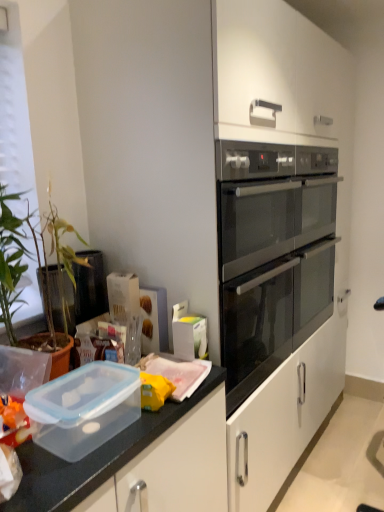
Question: Is transparent plastic container at lower left bigger or smaller than satin black oven at center right?

Choices:
 (A) small
 (B) big

Answer: (A)

Question: Is transparent plastic container at lower left inside or outside of satin black oven at center right?

Choices:
 (A) outside
 (B) inside

Answer: (A)

Question: In the image, is transparent plastic container at lower left on the left side or the right side of satin black oven at center right?

Choices:
 (A) left
 (B) right

Answer: (A)

Question: In terms of size, does satin black oven at center right appear bigger or smaller than transparent plastic container at lower left?

Choices:
 (A) big
 (B) small

Answer: (A)

Question: Visually, is satin black oven at center right positioned to the left or to the right of transparent plastic container at lower left?

Choices:
 (A) right
 (B) left

Answer: (A)

Question: Considering their positions, is satin black oven at center right located in front of or behind transparent plastic container at lower left?

Choices:
 (A) behind
 (B) front

Answer: (A)

Question: In terms of height, does satin black oven at center right look taller or shorter compared to transparent plastic container at lower left?

Choices:
 (A) short
 (B) tall

Answer: (B)